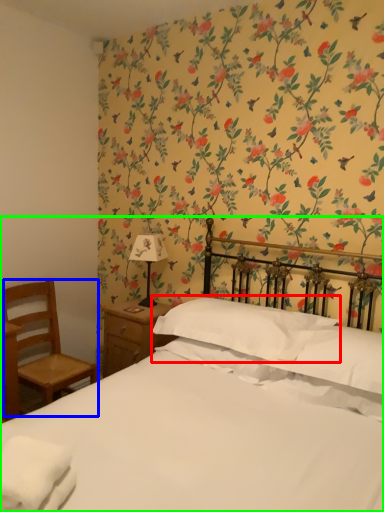
Question: Which object is positioned farthest from pillow (highlighted by a red box)? Select from chair (highlighted by a blue box) and bed (highlighted by a green box).

Choices:
 (A) chair
 (B) bed

Answer: (A)